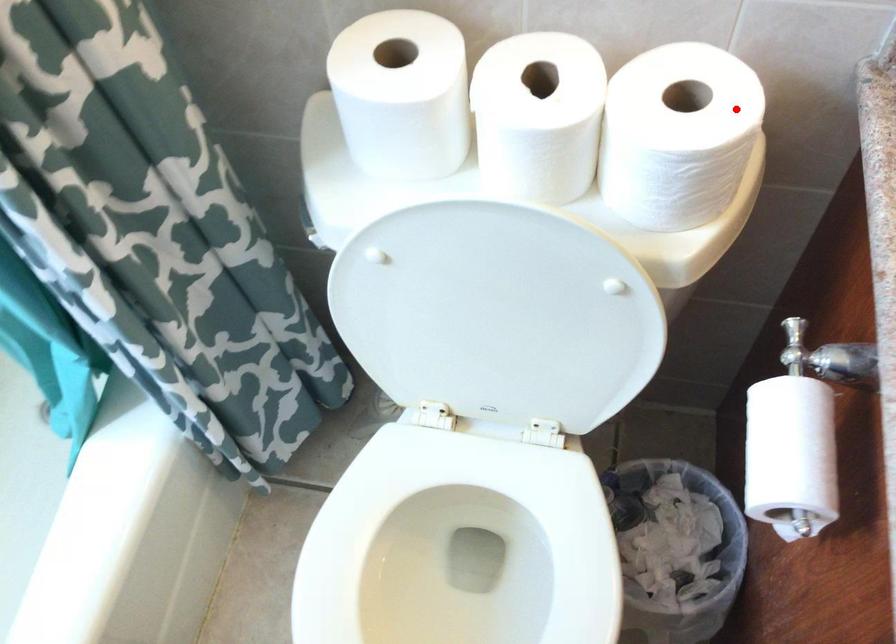
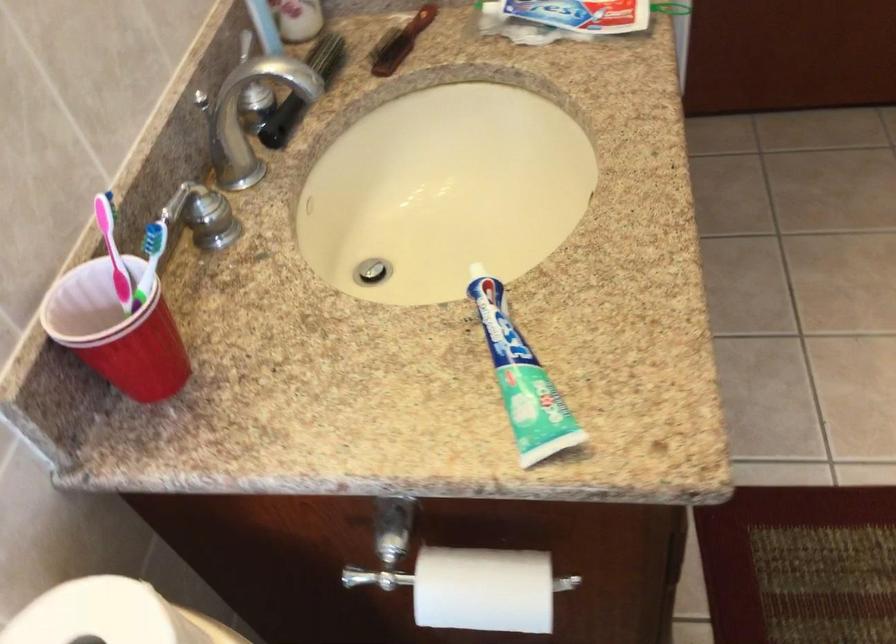
Question: I am providing you with two images of the same scene from different viewpoints. Image1 has a red point marked. In image2, the corresponding 3D location appears at what relative position? Reply with the corresponding letter.

Choices:
 (A) Closer
 (B) Farther

Answer: (A)